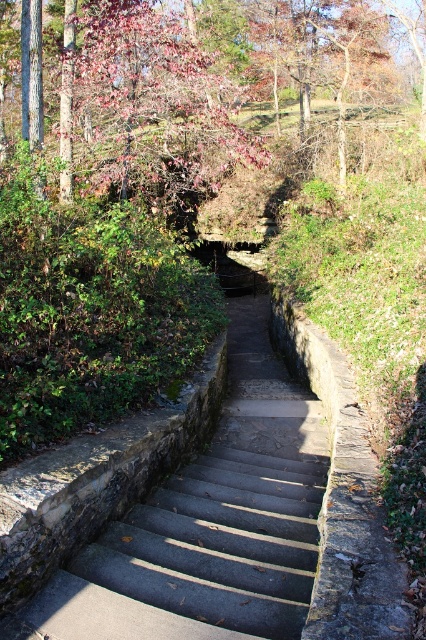
Question: Which object appears farthest from the camera in this image?

Choices:
 (A) reddish-brown bark tree at upper center
 (B) smooth concrete stairs at center

Answer: (A)

Question: Among these points, which one is farthest from the camera?

Choices:
 (A) (92, 44)
 (B) (245, 298)

Answer: (B)

Question: Is reddish-brown bark tree at upper center smaller than smooth concrete stairs at center?

Choices:
 (A) no
 (B) yes

Answer: (A)

Question: Can you confirm if reddish-brown bark tree at upper center is thinner than smooth concrete stairs at center?

Choices:
 (A) yes
 (B) no

Answer: (B)

Question: Is reddish-brown bark tree at upper center positioned before smooth concrete stairs at center?

Choices:
 (A) no
 (B) yes

Answer: (A)